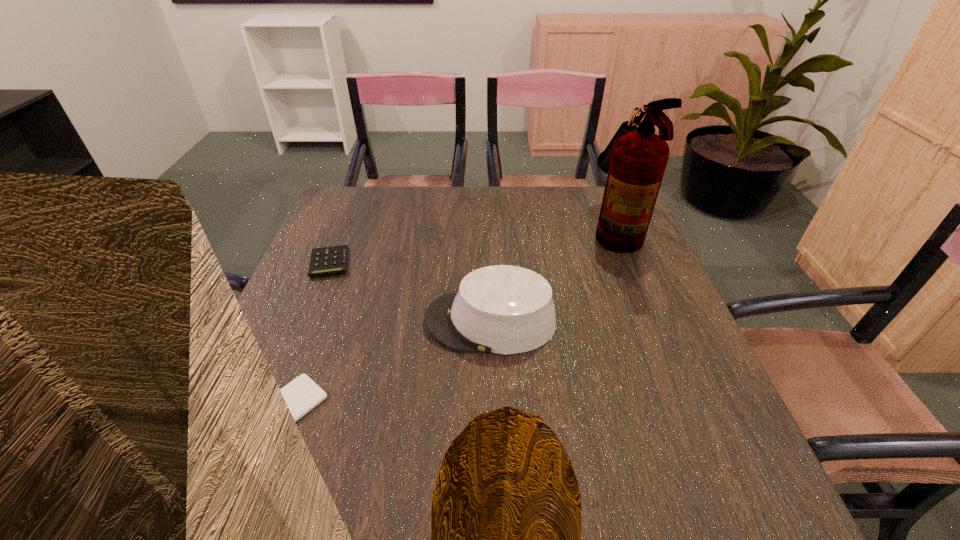
Identify the location of vacant space located 0.110m at the nozzle of the fire extinguisher. The image size is (960, 540). (554, 230).

What are the coordinates of `blank area located on the front-facing side of the third object from left to right` in the screenshot? It's located at (288, 321).

The width and height of the screenshot is (960, 540). I want to click on blank space located on the front-facing side of the third object from left to right, so coord(275,321).

Locate an element on the screen. vacant space located on the front-facing side of the third object from left to right is located at coordinates (328, 321).

Identify the location of free space located on the back of the farther calculator. The image size is (960, 540). (358, 192).

Where is `vacant space located 0.100m on the back of the nearer calculator`? The height and width of the screenshot is (540, 960). vacant space located 0.100m on the back of the nearer calculator is located at coordinates (315, 338).

This screenshot has height=540, width=960. In order to click on object that is at the far edge in this screenshot , I will do `click(635, 159)`.

I want to click on object present at the right edge, so click(x=635, y=159).

Locate an element on the screen. Image resolution: width=960 pixels, height=540 pixels. object at the far right corner is located at coordinates (635, 159).

In the image, there is a desktop. Identify the location of vacant space at the far edge. The width and height of the screenshot is (960, 540). (418, 216).